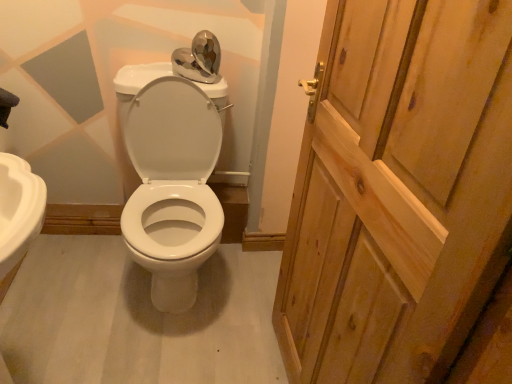
At what (x,y) coordinates should I click in order to perform the action: click on vacant space positioned to the left of white glossy toilet at center. Please return your answer as a coordinate pair (x, y). The width and height of the screenshot is (512, 384). Looking at the image, I should click on (71, 276).